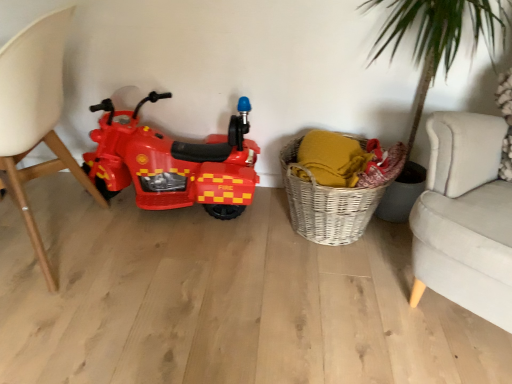
Question: From the image's perspective, is shiny plastic toy motorcycle at left located beneath matte white chair at left?

Choices:
 (A) yes
 (B) no

Answer: (B)

Question: Considering the relative positions of shiny plastic toy motorcycle at left and matte white chair at left in the image provided, is shiny plastic toy motorcycle at left to the left of matte white chair at left from the viewer's perspective?

Choices:
 (A) yes
 (B) no

Answer: (B)

Question: Would you consider shiny plastic toy motorcycle at left to be distant from matte white chair at left?

Choices:
 (A) yes
 (B) no

Answer: (B)

Question: From a real-world perspective, is shiny plastic toy motorcycle at left under matte white chair at left?

Choices:
 (A) yes
 (B) no

Answer: (A)

Question: Is shiny plastic toy motorcycle at left thinner than matte white chair at left?

Choices:
 (A) no
 (B) yes

Answer: (B)

Question: Is shiny plastic toy motorcycle at left bigger or smaller than woven wicker basket at lower right?

Choices:
 (A) small
 (B) big

Answer: (B)

Question: From the image's perspective, is shiny plastic toy motorcycle at left located above or below woven wicker basket at lower right?

Choices:
 (A) above
 (B) below

Answer: (A)

Question: Looking at their shapes, would you say shiny plastic toy motorcycle at left is wider or thinner than woven wicker basket at lower right?

Choices:
 (A) wide
 (B) thin

Answer: (B)

Question: Is shiny plastic toy motorcycle at left in front of or behind woven wicker basket at lower right in the image?

Choices:
 (A) behind
 (B) front

Answer: (A)

Question: From the image's perspective, relative to woven wicker basket at lower right, is matte white chair at left above or below?

Choices:
 (A) above
 (B) below

Answer: (A)

Question: Would you say matte white chair at left is inside or outside woven wicker basket at lower right?

Choices:
 (A) inside
 (B) outside

Answer: (B)

Question: From their relative heights in the image, would you say matte white chair at left is taller or shorter than woven wicker basket at lower right?

Choices:
 (A) short
 (B) tall

Answer: (B)

Question: Would you say matte white chair at left is to the left or to the right of woven wicker basket at lower right in the picture?

Choices:
 (A) left
 (B) right

Answer: (A)

Question: Does point click(x=112, y=150) appear closer or farther from the camera than point click(x=54, y=36)?

Choices:
 (A) farther
 (B) closer

Answer: (A)

Question: From the image's perspective, relative to matte white chair at left, is shiny plastic toy motorcycle at left above or below?

Choices:
 (A) below
 (B) above

Answer: (B)